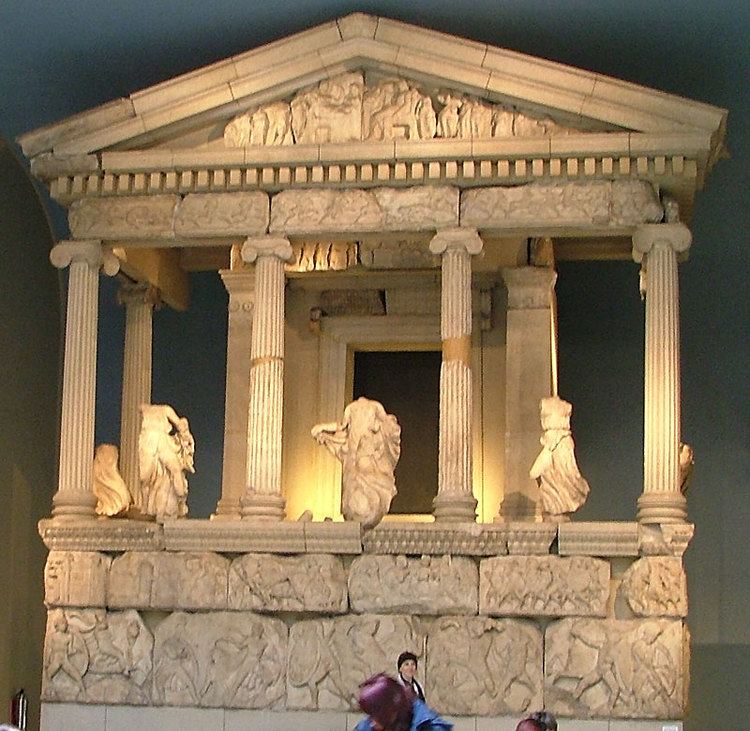
The height and width of the screenshot is (731, 750). Find the location of `bottom of doorway`. bottom of doorway is located at coordinates (391, 512), (428, 512).